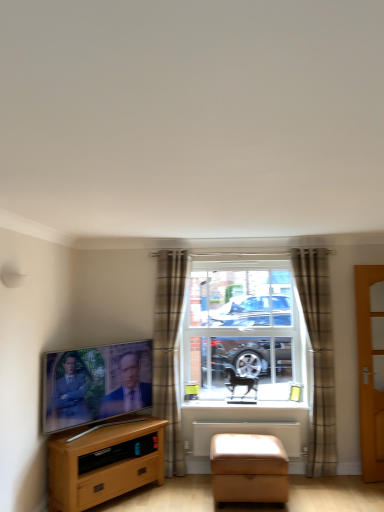
Question: Is the position of white plastic radiator at lower center more distant than that of light brown wood tv stand at lower left?

Choices:
 (A) yes
 (B) no

Answer: (A)

Question: Does white plastic radiator at lower center have a greater height compared to light brown wood tv stand at lower left?

Choices:
 (A) no
 (B) yes

Answer: (A)

Question: Is light brown wood tv stand at lower left inside white plastic radiator at lower center?

Choices:
 (A) yes
 (B) no

Answer: (B)

Question: Is white plastic radiator at lower center aimed at light brown wood tv stand at lower left?

Choices:
 (A) no
 (B) yes

Answer: (A)

Question: Is white plastic radiator at lower center in front of light brown wood tv stand at lower left?

Choices:
 (A) yes
 (B) no

Answer: (B)

Question: Does white plastic radiator at lower center have a larger size compared to light brown wood tv stand at lower left?

Choices:
 (A) yes
 (B) no

Answer: (B)

Question: Can you confirm if light brown wood tv stand at lower left is positioned to the left of plaid fabric curtain at center, the 1th curtain in the left-to-right sequence?

Choices:
 (A) no
 (B) yes

Answer: (B)

Question: Is light brown wood tv stand at lower left shorter than plaid fabric curtain at center, positioned as the 2th curtain in right-to-left order?

Choices:
 (A) no
 (B) yes

Answer: (B)

Question: Is light brown wood tv stand at lower left in front of plaid fabric curtain at center, the 1th curtain in the left-to-right sequence?

Choices:
 (A) yes
 (B) no

Answer: (A)

Question: Is light brown wood tv stand at lower left behind plaid fabric curtain at center, positioned as the 2th curtain in right-to-left order?

Choices:
 (A) yes
 (B) no

Answer: (B)

Question: Is light brown wood tv stand at lower left next to plaid fabric curtain at center, the 1th curtain in the left-to-right sequence, and touching it?

Choices:
 (A) no
 (B) yes

Answer: (A)

Question: Is light brown wood tv stand at lower left oriented away from plaid fabric curtain at center, the 1th curtain in the left-to-right sequence?

Choices:
 (A) no
 (B) yes

Answer: (A)

Question: Considering the relative sizes of plaid fabric curtain at center, positioned as the 2th curtain in right-to-left order, and matte black tv at left in the image provided, is plaid fabric curtain at center, positioned as the 2th curtain in right-to-left order, smaller than matte black tv at left?

Choices:
 (A) yes
 (B) no

Answer: (B)